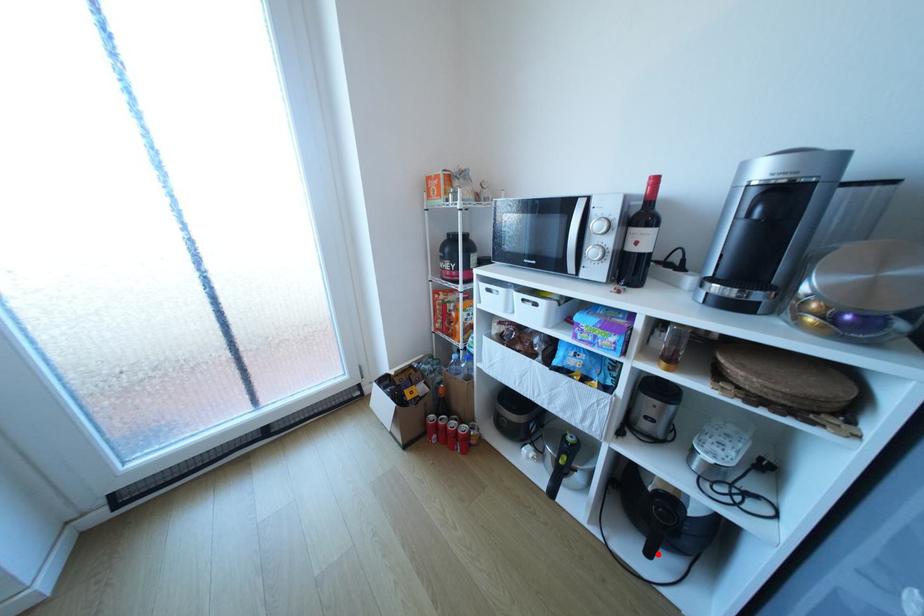
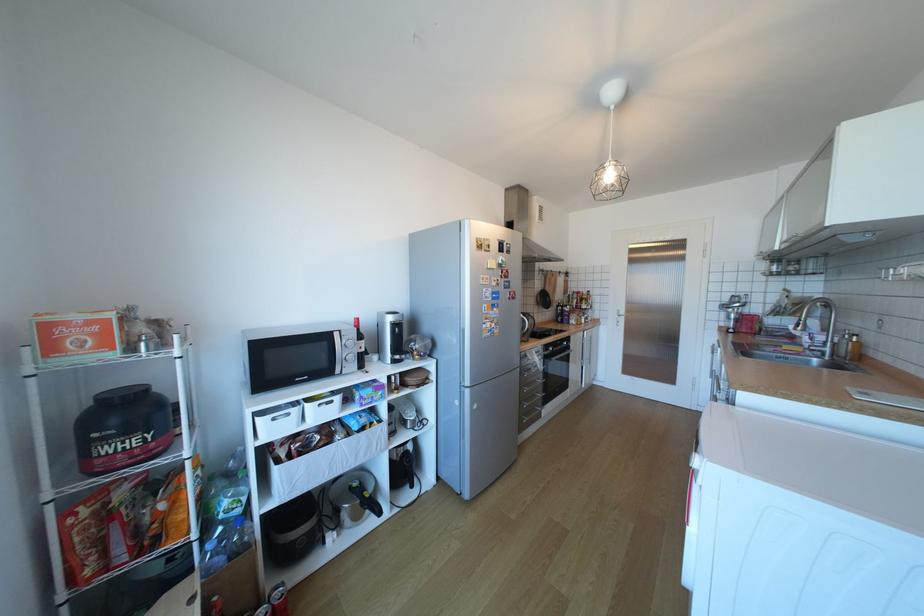
Where in the second image is the point corresponding to the highlighted location from the first image?

(420, 485)